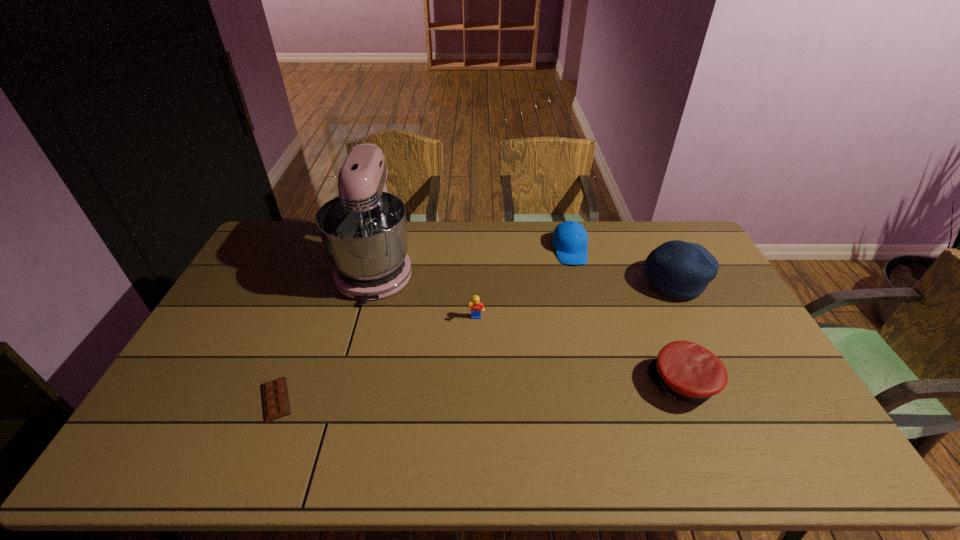
At what (x,y) coordinates should I click in order to perform the action: click on the tallest object. Please return your answer as a coordinate pair (x, y). This screenshot has height=540, width=960. Looking at the image, I should click on (364, 233).

You are a GUI agent. You are given a task and a screenshot of the screen. Output one action in this format:
    pyautogui.click(x=<x>, y=<y>)
    Task: Click on the fifth shortest object
    
    Given the screenshot: What is the action you would take?
    pyautogui.click(x=681, y=270)

At what (x,y) coordinates should I click in order to perform the action: click on the third object from right to left. Please return your answer as a coordinate pair (x, y). Image resolution: width=960 pixels, height=540 pixels. Looking at the image, I should click on (570, 239).

I want to click on the farther cap, so click(570, 239).

Where is `the third object from left to right`? the third object from left to right is located at coordinates (477, 307).

Where is `the third nearest object`? The width and height of the screenshot is (960, 540). the third nearest object is located at coordinates (477, 307).

This screenshot has height=540, width=960. I want to click on the nearer cap, so click(687, 371).

Locate an element on the screen. This screenshot has height=540, width=960. chocolate bar is located at coordinates (276, 404).

The height and width of the screenshot is (540, 960). In order to click on free region located on the front-facing side of the mixer in this screenshot , I will do `click(342, 390)`.

You are a GUI agent. You are given a task and a screenshot of the screen. Output one action in this format:
    pyautogui.click(x=<x>, y=<y>)
    Task: Click on the blank area located on the front of the second tallest object
    Image resolution: width=960 pixels, height=540 pixels.
    Given the screenshot: What is the action you would take?
    pyautogui.click(x=706, y=350)